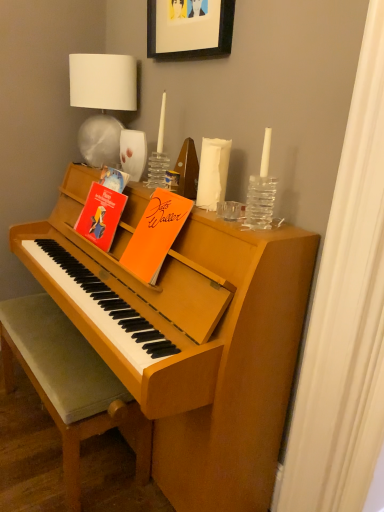
The image size is (384, 512). Describe the element at coordinates (155, 234) in the screenshot. I see `orange matte paper at upper center, the first paperback book positioned from the right` at that location.

The width and height of the screenshot is (384, 512). Identify the location of white fabric lampshade at upper left. (102, 102).

Between point (76, 405) and point (109, 102), which one is positioned behind?

Positioned behind is point (109, 102).

How distant is velvet grey cushioned bench at lower left from white fabric lampshade at upper left?

velvet grey cushioned bench at lower left and white fabric lampshade at upper left are 38.16 inches apart.

Is velvet grey cushioned bench at lower left located outside white fabric lampshade at upper left?

Yes.

Is velvet grey cushioned bench at lower left to the left or to the right of white fabric lampshade at upper left in the image?

From the image, it's evident that velvet grey cushioned bench at lower left is to the left of white fabric lampshade at upper left.

Considering their positions, is orange matte paper at upper center, placed as the 2th paperback book when sorted from left to right, located in front of or behind matte paper book at upper left, the 2th paperback book when ordered from right to left?

Visually, orange matte paper at upper center, placed as the 2th paperback book when sorted from left to right, is located in front of matte paper book at upper left, the 2th paperback book when ordered from right to left.

Looking at their sizes, would you say orange matte paper at upper center, the first paperback book positioned from the right, is wider or thinner than matte paper book at upper left, the 2th paperback book when ordered from right to left?

Considering their sizes, orange matte paper at upper center, the first paperback book positioned from the right, looks broader than matte paper book at upper left, the 2th paperback book when ordered from right to left.

Who is smaller, orange matte paper at upper center, placed as the 2th paperback book when sorted from left to right, or matte paper book at upper left, which appears as the first paperback book when viewed from the left?

With smaller size is matte paper book at upper left, which appears as the first paperback book when viewed from the left.

Considering their positions, is black matte picture frame at upper center located in front of or behind orange matte paper at upper center, placed as the 2th paperback book when sorted from left to right?

black matte picture frame at upper center is behind orange matte paper at upper center, placed as the 2th paperback book when sorted from left to right.

Is black matte picture frame at upper center inside the boundaries of orange matte paper at upper center, the first paperback book positioned from the right, or outside?

black matte picture frame at upper center exists outside the volume of orange matte paper at upper center, the first paperback book positioned from the right.

Can you confirm if black matte picture frame at upper center is shorter than orange matte paper at upper center, the first paperback book positioned from the right?

Yes, black matte picture frame at upper center is shorter than orange matte paper at upper center, the first paperback book positioned from the right.

Considering the relative sizes of black matte picture frame at upper center and orange matte paper at upper center, the first paperback book positioned from the right, in the image provided, is black matte picture frame at upper center bigger than orange matte paper at upper center, the first paperback book positioned from the right,?

No.

Is point (206, 10) positioned before point (75, 86)?

That is True.

From the image's perspective, which is above, black matte picture frame at upper center or white fabric lampshade at upper left?

black matte picture frame at upper center, from the image's perspective.

Looking at this image, is black matte picture frame at upper center not inside white fabric lampshade at upper left?

Yes, black matte picture frame at upper center is located beyond the bounds of white fabric lampshade at upper left.

Is white fabric lampshade at upper left not inside black matte picture frame at upper center?

That's correct, white fabric lampshade at upper left is outside of black matte picture frame at upper center.

Which of these two, white fabric lampshade at upper left or black matte picture frame at upper center, stands taller?

white fabric lampshade at upper left is taller.

Is white fabric lampshade at upper left oriented towards black matte picture frame at upper center?

No.

Considering the sizes of objects velvet grey cushioned bench at lower left and matte paper book at upper left, which appears as the first paperback book when viewed from the left, in the image provided, who is shorter, velvet grey cushioned bench at lower left or matte paper book at upper left, which appears as the first paperback book when viewed from the left,?

matte paper book at upper left, which appears as the first paperback book when viewed from the left.

Is velvet grey cushioned bench at lower left facing towards matte paper book at upper left, which appears as the first paperback book when viewed from the left?

No, velvet grey cushioned bench at lower left is not facing towards matte paper book at upper left, which appears as the first paperback book when viewed from the left.

In the scene shown: Which object is further away from the camera, velvet grey cushioned bench at lower left or matte paper book at upper left, the 2th paperback book when ordered from right to left?

matte paper book at upper left, the 2th paperback book when ordered from right to left, is behind.

Between matte paper book at upper left, the 2th paperback book when ordered from right to left, and white fabric lampshade at upper left, which one is positioned behind?

white fabric lampshade at upper left is more distant.

From the image's perspective, between matte paper book at upper left, the 2th paperback book when ordered from right to left, and white fabric lampshade at upper left, who is located below?

matte paper book at upper left, the 2th paperback book when ordered from right to left, appears lower in the image.

Can you confirm if matte paper book at upper left, the 2th paperback book when ordered from right to left, is bigger than white fabric lampshade at upper left?

Incorrect, matte paper book at upper left, the 2th paperback book when ordered from right to left, is not larger than white fabric lampshade at upper left.

In the image, is matte paper book at upper left, the 2th paperback book when ordered from right to left, on the left side or the right side of white fabric lampshade at upper left?

matte paper book at upper left, the 2th paperback book when ordered from right to left, is to the right of white fabric lampshade at upper left.

You are a GUI agent. You are given a task and a screenshot of the screen. Output one action in this format:
    pyautogui.click(x=<x>, y=<y>)
    Task: Click on the chair below the white fabric lampshade at upper left (from a real-world perspective)
    
    Given the screenshot: What is the action you would take?
    69,383

Identify the location of paperback book to the left of orange matte paper at upper center, the first paperback book positioned from the right. The image size is (384, 512). (101, 215).

In the scene shown: Based on their spatial positions, is black matte picture frame at upper center or velvet grey cushioned bench at lower left further from matte paper book at upper left, the 2th paperback book when ordered from right to left?

black matte picture frame at upper center is positioned further to the anchor matte paper book at upper left, the 2th paperback book when ordered from right to left.

Considering their positions, is matte paper book at upper left, which appears as the first paperback book when viewed from the left, positioned closer to orange matte paper at upper center, placed as the 2th paperback book when sorted from left to right, than velvet grey cushioned bench at lower left?

Among the two, matte paper book at upper left, which appears as the first paperback book when viewed from the left, is located nearer to orange matte paper at upper center, placed as the 2th paperback book when sorted from left to right.

Which object lies further to the anchor point orange matte paper at upper center, placed as the 2th paperback book when sorted from left to right, white fabric lampshade at upper left or velvet grey cushioned bench at lower left?

Based on the image, white fabric lampshade at upper left appears to be further to orange matte paper at upper center, placed as the 2th paperback book when sorted from left to right.

When comparing their distances from matte paper book at upper left, which appears as the first paperback book when viewed from the left, does black matte picture frame at upper center or orange matte paper at upper center, the first paperback book positioned from the right, seem closer?

The object closer to matte paper book at upper left, which appears as the first paperback book when viewed from the left, is orange matte paper at upper center, the first paperback book positioned from the right.

Estimate the real-world distances between objects in this image. Which object is closer to velvet grey cushioned bench at lower left, white fabric lampshade at upper left or matte paper book at upper left, the 2th paperback book when ordered from right to left?

Based on the image, matte paper book at upper left, the 2th paperback book when ordered from right to left, appears to be nearer to velvet grey cushioned bench at lower left.

When comparing their distances from black matte picture frame at upper center, does velvet grey cushioned bench at lower left or white fabric lampshade at upper left seem closer?

white fabric lampshade at upper left is closer to black matte picture frame at upper center.

From the image, which object appears to be nearer to matte paper book at upper left, the 2th paperback book when ordered from right to left, black matte picture frame at upper center or white fabric lampshade at upper left?

white fabric lampshade at upper left is positioned closer to the anchor matte paper book at upper left, the 2th paperback book when ordered from right to left.

Looking at the image, which one is located closer to black matte picture frame at upper center, velvet grey cushioned bench at lower left or matte paper book at upper left, which appears as the first paperback book when viewed from the left?

Among the two, matte paper book at upper left, which appears as the first paperback book when viewed from the left, is located nearer to black matte picture frame at upper center.

The image size is (384, 512). Identify the location of table lamp between black matte picture frame at upper center and orange matte paper at upper center, the first paperback book positioned from the right, in the up-down direction. (102, 102).

Identify the location of paperback book between white fabric lampshade at upper left and orange matte paper at upper center, the first paperback book positioned from the right, in the vertical direction. The width and height of the screenshot is (384, 512). (101, 215).

Locate an element on the screen. The image size is (384, 512). paperback book between matte paper book at upper left, which appears as the first paperback book when viewed from the left, and velvet grey cushioned bench at lower left vertically is located at coordinates (155, 234).

Image resolution: width=384 pixels, height=512 pixels. What are the coordinates of `table lamp between black matte picture frame at upper center and matte paper book at upper left, which appears as the first paperback book when viewed from the left, vertically` in the screenshot? It's located at (102, 102).